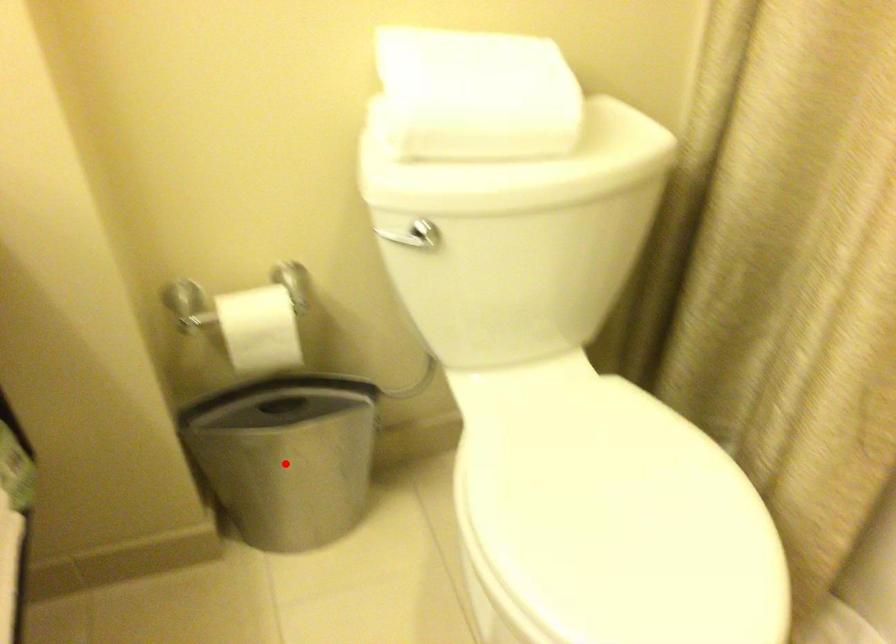
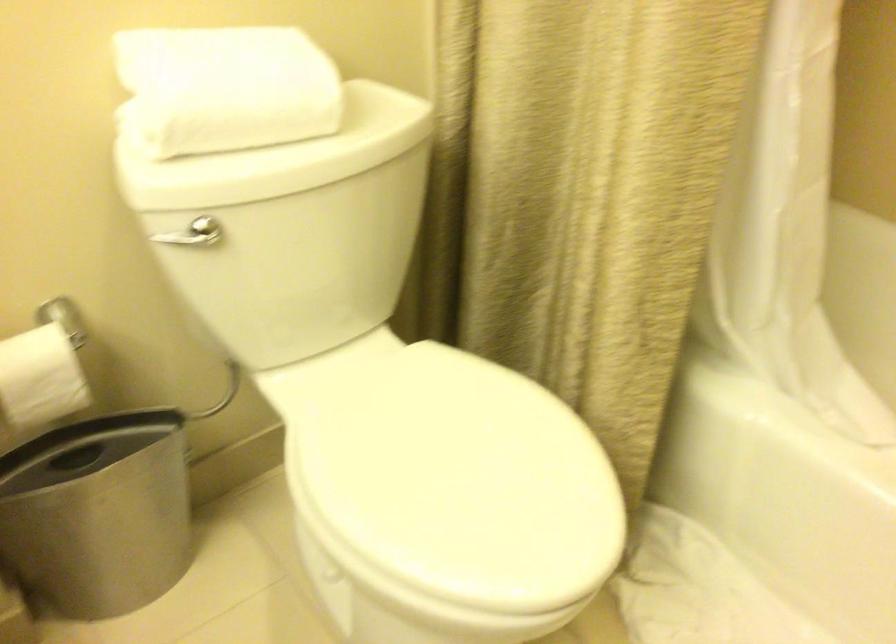
Question: I am providing you with two images of the same scene from different viewpoints. Image1 has a red point marked. In image2, the corresponding 3D location appears at what relative position? Reply with the corresponding letter.

Choices:
 (A) Closer
 (B) Farther

Answer: (A)